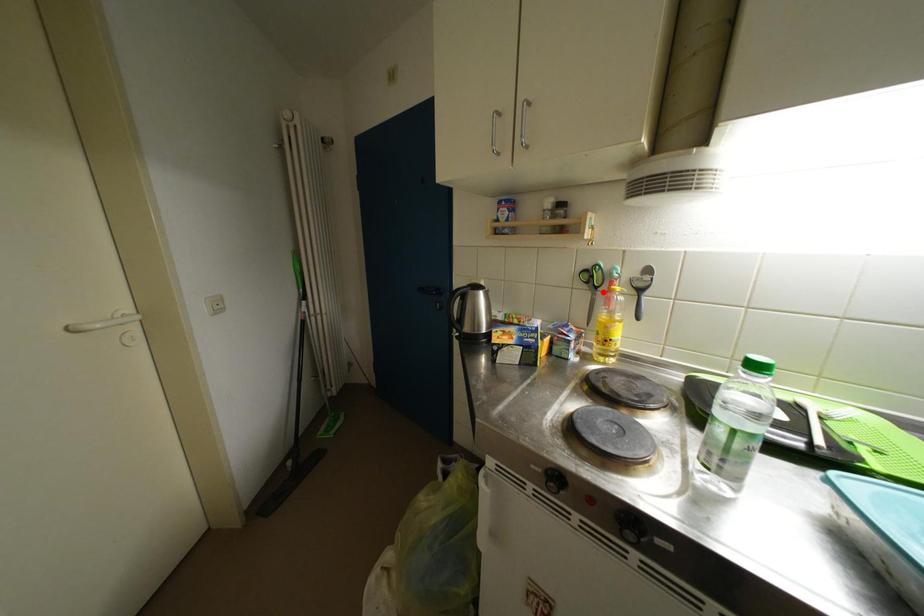
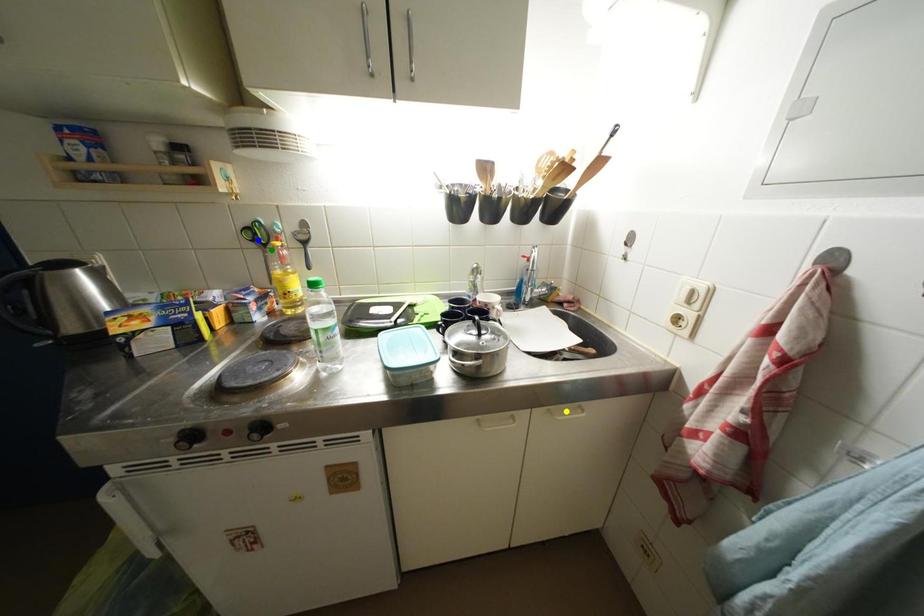
Question: I am providing you with two images of the same scene from different viewpoints. A red point is marked on the first image. You are given multiple points on the second image. Which point in image 2 represents the same 3d spot as the red point in image 1?

Choices:
 (A) green point
 (B) yellow point
 (C) blue point

Answer: (A)